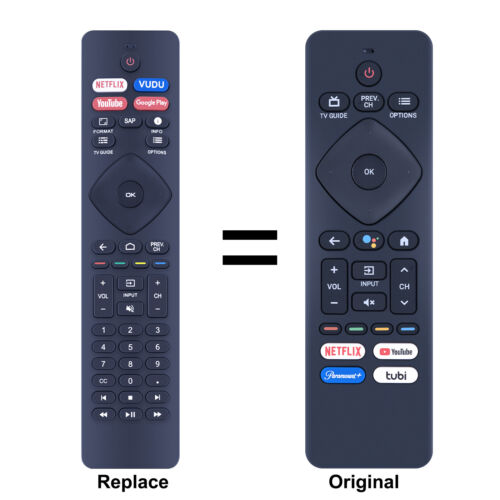
I want to click on remote control number button, so [x=102, y=330], [x=131, y=326], [x=155, y=328], [x=158, y=347], [x=133, y=343], [x=105, y=345], [x=102, y=360], [x=128, y=362], [x=156, y=362], [x=129, y=378].